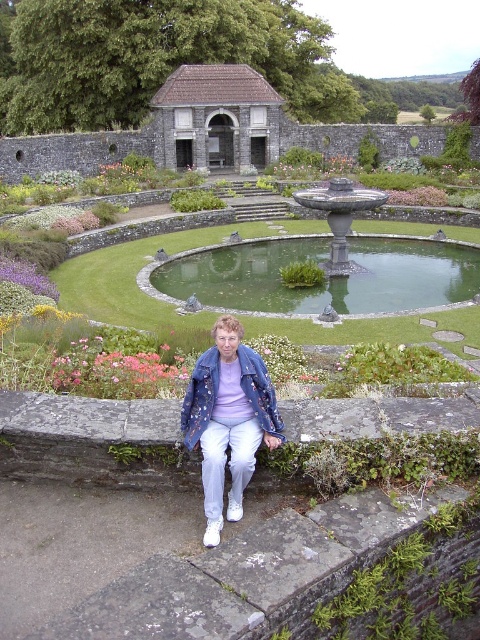
You are a gardener planning to install a new water feature. You have a small statue that is 1.2 meters tall. Can the statue fit vertically inside the green stone pond at center without exceeding its height? Please consider the height of the purple matte flower at lower left as a reference point.

The green stone pond at center is taller than the purple matte flower at lower left. Since the statue is 1.2 meters tall, and the pond is taller than the flower, it is possible that the statue can fit inside the pond. However, without knowing the exact height of the flower, we cannot confirm definitively.

You are a gardener who needs to place a new decorative item in the garden. You have a denim jacket at lower center and pink matte flowers at lower left. Which object has a smaller width when viewed from above?

The denim jacket at lower center is thinner than the pink matte flowers at lower left, so the denim jacket at lower center has a smaller width when viewed from above.

You are standing in the garden and want to take a photo of both the point at coordinates [80,355] and the point at coordinates [20,272]. Which point will appear larger in your camera view?

Point [80,355] is closer to the camera than point [20,272], so it will appear larger in the camera view.